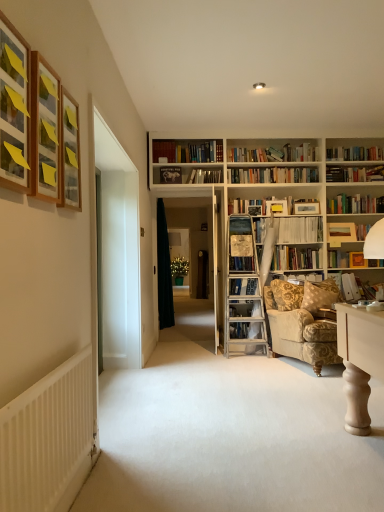
Question: Is wooden picture frame at upper left, acting as the fourth picture frame starting from the right, beside wooden book at upper right, which is counted as the third book, starting from the top?

Choices:
 (A) yes
 (B) no

Answer: (B)

Question: Is wooden picture frame at upper left, the first picture frame when ordered from left to right, further to the viewer compared to wooden book at upper right, which is counted as the third book, starting from the top?

Choices:
 (A) yes
 (B) no

Answer: (B)

Question: Considering the relative sizes of wooden picture frame at upper left, which is the first picture frame from front to back, and wooden book at upper right, which is counted as the third book, starting from the top, in the image provided, is wooden picture frame at upper left, which is the first picture frame from front to back, bigger than wooden book at upper right, which is counted as the third book, starting from the top,?

Choices:
 (A) yes
 (B) no

Answer: (A)

Question: Is wooden book at upper right, the third book when ordered from right to left, located within wooden picture frame at upper left, the 4th picture frame when ordered from back to front?

Choices:
 (A) no
 (B) yes

Answer: (A)

Question: Is wooden picture frame at upper left, which is the first picture frame from front to back, shorter than wooden book at upper right, which is counted as the third book, starting from the top?

Choices:
 (A) no
 (B) yes

Answer: (A)

Question: From the image's perspective, relative to white ribbed radiator at lower left, is transparent glass door at center above or below?

Choices:
 (A) below
 (B) above

Answer: (B)

Question: Is transparent glass door at center in front of or behind white ribbed radiator at lower left in the image?

Choices:
 (A) behind
 (B) front

Answer: (A)

Question: Is transparent glass door at center situated inside white ribbed radiator at lower left or outside?

Choices:
 (A) outside
 (B) inside

Answer: (A)

Question: In the image, is transparent glass door at center on the left side or the right side of white ribbed radiator at lower left?

Choices:
 (A) right
 (B) left

Answer: (A)

Question: Considering their positions, is wooden book at upper right, the third book when ordered from right to left, located in front of or behind gold-patterned fabric armchair at lower right?

Choices:
 (A) behind
 (B) front

Answer: (A)

Question: Considering the positions of point (331, 224) and point (321, 333), is point (331, 224) closer or farther from the camera than point (321, 333)?

Choices:
 (A) closer
 (B) farther

Answer: (B)

Question: Visually, is wooden book at upper right, the third book when ordered from right to left, positioned to the left or to the right of gold-patterned fabric armchair at lower right?

Choices:
 (A) left
 (B) right

Answer: (B)

Question: In terms of width, does wooden book at upper right, which is the 3th book from left to right, look wider or thinner when compared to gold-patterned fabric armchair at lower right?

Choices:
 (A) thin
 (B) wide

Answer: (A)

Question: From the image's perspective, is hardcover book at upper center, the 1th book from the top, above or below white paper book at center, which is counted as the 4th book, starting from the bottom?

Choices:
 (A) below
 (B) above

Answer: (B)

Question: Does point pyautogui.click(x=208, y=176) appear closer or farther from the camera than point pyautogui.click(x=297, y=228)?

Choices:
 (A) farther
 (B) closer

Answer: (B)